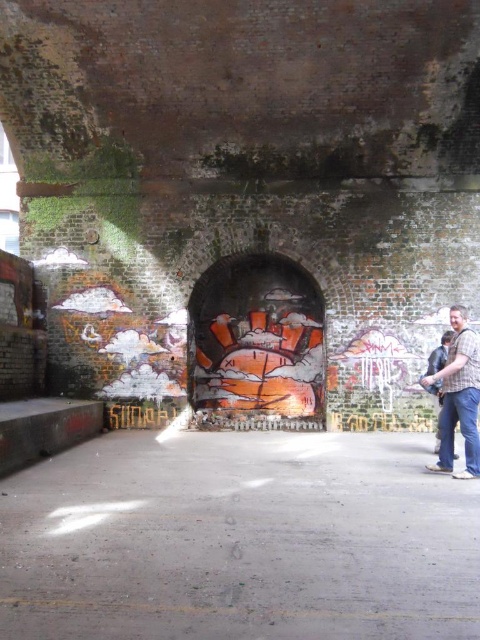
Question: Is matte brown jacket at right to the right of plaid shirt at right from the viewer's perspective?

Choices:
 (A) yes
 (B) no

Answer: (B)

Question: Which point appears closest to the camera in this image?

Choices:
 (A) (444, 344)
 (B) (470, 339)

Answer: (B)

Question: Which point appears farthest from the camera in this image?

Choices:
 (A) (468, 365)
 (B) (442, 349)

Answer: (B)

Question: Can you confirm if matte brown jacket at right is positioned to the right of plaid shirt at right?

Choices:
 (A) yes
 (B) no

Answer: (B)

Question: Can you confirm if matte brown jacket at right is positioned to the left of plaid shirt at right?

Choices:
 (A) no
 (B) yes

Answer: (B)